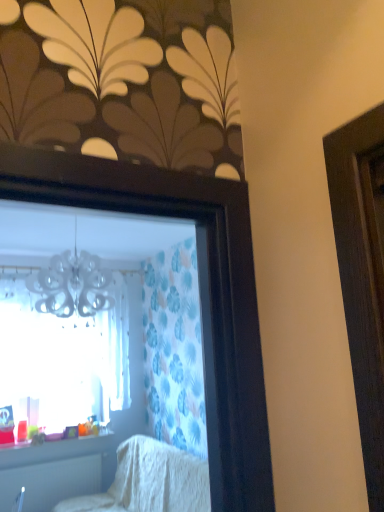
Question: Is translucent plastic cups at lower left spatially inside white plastic radiator at lower left, or outside of it?

Choices:
 (A) outside
 (B) inside

Answer: (A)

Question: Looking at their shapes, would you say translucent plastic cups at lower left is wider or thinner than white plastic radiator at lower left?

Choices:
 (A) thin
 (B) wide

Answer: (B)

Question: Estimate the real-world distances between objects in this image. Which object is closer to the white textured blanket at lower center?

Choices:
 (A) transparent glass window at upper left
 (B) translucent plastic cups at lower left
 (C) white plastic radiator at lower left

Answer: (C)

Question: Which of these objects is positioned farthest from the translucent plastic cups at lower left?

Choices:
 (A) transparent glass window at upper left
 (B) white plastic radiator at lower left
 (C) white textured blanket at lower center

Answer: (C)